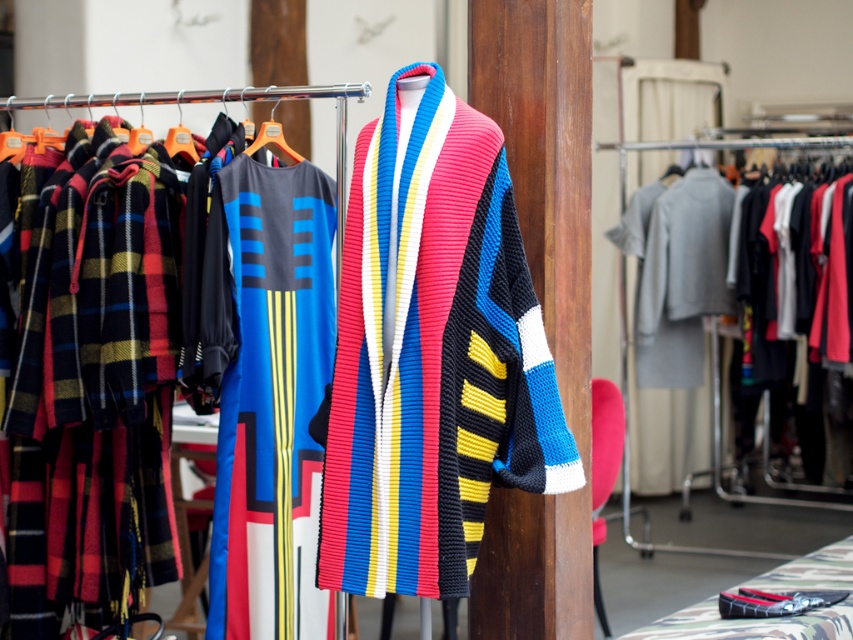
Question: Which object appears closest to the camera in this image?

Choices:
 (A) knitted multicolored sweater at center
 (B) orange plastic hanger at center
 (C) knitted fabric dress at center
 (D) knitted wool sweater at center

Answer: (A)

Question: Which object is the farthest from the knitted multicolored sweater at center?

Choices:
 (A) knitted fabric dress at center
 (B) orange plastic hanger at center
 (C) knitted wool sweater at center

Answer: (B)

Question: Which of the following is the farthest from the observer?

Choices:
 (A) knitted multicolored sweater at center
 (B) knitted wool sweater at center
 (C) knitted fabric dress at center

Answer: (C)

Question: Is knitted multicolored sweater at center to the right of knitted wool sweater at center from the viewer's perspective?

Choices:
 (A) no
 (B) yes

Answer: (B)

Question: Can you confirm if knitted multicolored sweater at center is thinner than orange plastic hanger at center?

Choices:
 (A) no
 (B) yes

Answer: (A)

Question: Does knitted wool sweater at center have a larger size compared to orange plastic hanger at center?

Choices:
 (A) no
 (B) yes

Answer: (B)